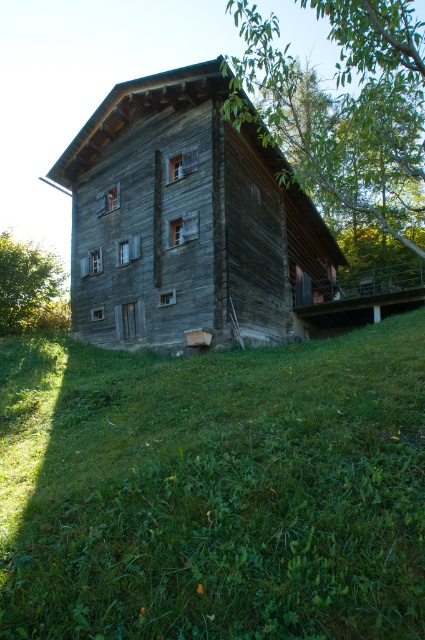
Question: Is green grassy at lower center further to the viewer compared to weathered wood hut at center?

Choices:
 (A) no
 (B) yes

Answer: (A)

Question: Among these points, which one is nearest to the camera?

Choices:
 (A) (274, 296)
 (B) (22, 296)
 (C) (336, 26)
 (D) (36, 442)

Answer: (D)

Question: Which object is closer to the camera taking this photo?

Choices:
 (A) green leafy tree at upper right
 (B) green grassy at lower center

Answer: (B)

Question: Which object is positioned farthest from the green grassy at lower center?

Choices:
 (A) green leafy tree at upper right
 (B) weathered wood hut at center
 (C) green leafy tree at lower left

Answer: (A)

Question: Can you confirm if green grassy at lower center is positioned to the left of green leafy tree at upper right?

Choices:
 (A) yes
 (B) no

Answer: (A)

Question: Is green grassy at lower center smaller than green leafy tree at lower left?

Choices:
 (A) no
 (B) yes

Answer: (B)